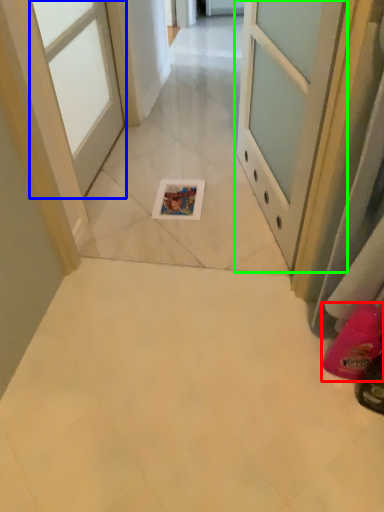
Question: Based on their relative distances, which object is nearer to footwear (highlighted by a red box)? Choose from door (highlighted by a blue box) and door (highlighted by a green box).

Choices:
 (A) door
 (B) door

Answer: (B)